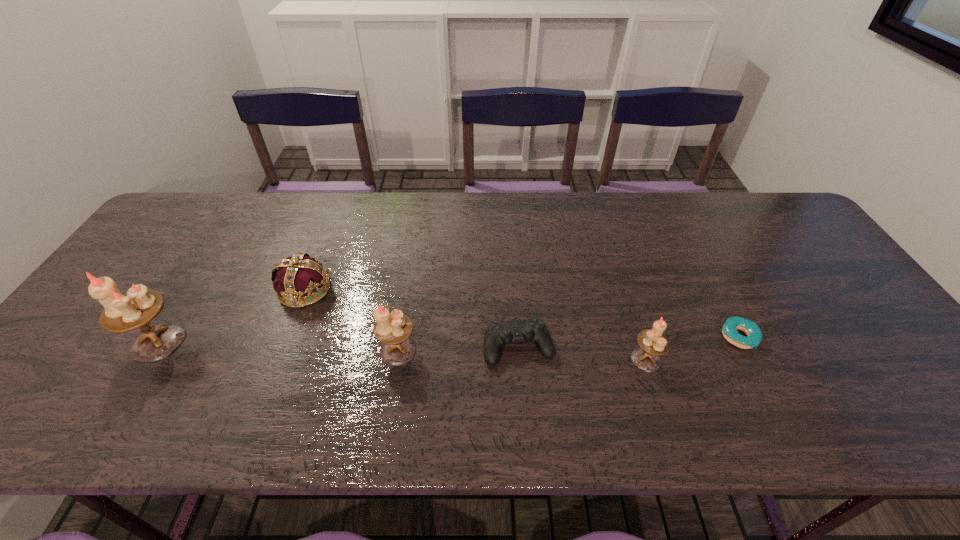
Find the location of `the leftmost candle holder`. the leftmost candle holder is located at coordinates (139, 306).

The width and height of the screenshot is (960, 540). I want to click on the leftmost object, so click(139, 306).

Where is `the second candle holder from right to left`? the second candle holder from right to left is located at coordinates (393, 330).

You are a GUI agent. You are given a task and a screenshot of the screen. Output one action in this format:
    pyautogui.click(x=<x>, y=<y>)
    Task: Click on the fourth object from right to left
    
    Given the screenshot: What is the action you would take?
    pyautogui.click(x=393, y=330)

Locate an element on the screen. the fifth object from left to right is located at coordinates (653, 343).

The width and height of the screenshot is (960, 540). In order to click on the third tallest object in this screenshot , I will do `click(653, 343)`.

Identify the location of the farthest object. The height and width of the screenshot is (540, 960). (300, 275).

Where is `the fifth object from right to left`? the fifth object from right to left is located at coordinates (300, 275).

Where is `doughnut`? This screenshot has width=960, height=540. doughnut is located at coordinates (754, 335).

Where is `the rightmost object`? the rightmost object is located at coordinates (754, 335).